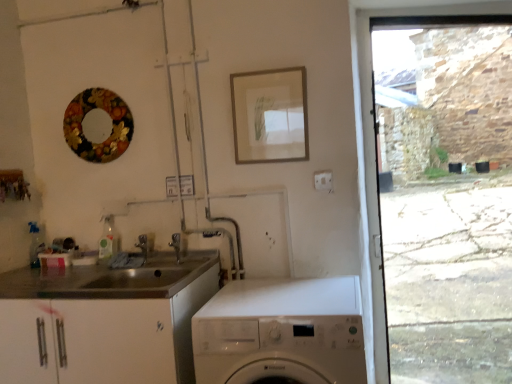
Question: Are silver metallic tap at center, placed as the 2th tap when sorted from front to back, and white glossy washing machine at lower center beside each other?

Choices:
 (A) no
 (B) yes

Answer: (A)

Question: Is silver metallic tap at center, which ranks as the second tap in right-to-left order, thinner than white glossy washing machine at lower center?

Choices:
 (A) no
 (B) yes

Answer: (B)

Question: Considering the relative sizes of silver metallic tap at center, which appears as the first tap when viewed from the back, and white glossy washing machine at lower center in the image provided, is silver metallic tap at center, which appears as the first tap when viewed from the back, shorter than white glossy washing machine at lower center?

Choices:
 (A) no
 (B) yes

Answer: (B)

Question: Is silver metallic tap at center, placed as the 2th tap when sorted from front to back, looking in the opposite direction of white glossy washing machine at lower center?

Choices:
 (A) no
 (B) yes

Answer: (A)

Question: Does silver metallic tap at center, which appears as the first tap when viewed from the left, have a greater width compared to white glossy washing machine at lower center?

Choices:
 (A) yes
 (B) no

Answer: (B)

Question: Is silver metallic tap at center, which appears as the first tap when viewed from the back, at the right side of white glossy washing machine at lower center?

Choices:
 (A) no
 (B) yes

Answer: (A)

Question: Is wooden frame at upper center outside of white glossy washing machine at lower center?

Choices:
 (A) no
 (B) yes

Answer: (B)

Question: Considering the relative positions of wooden frame at upper center and white glossy washing machine at lower center in the image provided, is wooden frame at upper center behind white glossy washing machine at lower center?

Choices:
 (A) yes
 (B) no

Answer: (A)

Question: Considering the relative sizes of wooden frame at upper center and white glossy washing machine at lower center in the image provided, is wooden frame at upper center thinner than white glossy washing machine at lower center?

Choices:
 (A) no
 (B) yes

Answer: (B)

Question: Is wooden frame at upper center far away from white glossy washing machine at lower center?

Choices:
 (A) yes
 (B) no

Answer: (B)

Question: From a real-world perspective, is wooden frame at upper center beneath white glossy washing machine at lower center?

Choices:
 (A) no
 (B) yes

Answer: (A)

Question: Is wooden frame at upper center in front of white glossy washing machine at lower center?

Choices:
 (A) no
 (B) yes

Answer: (A)

Question: Does metallic floral wreath at upper left have a lesser height compared to wooden frame at upper center?

Choices:
 (A) yes
 (B) no

Answer: (A)